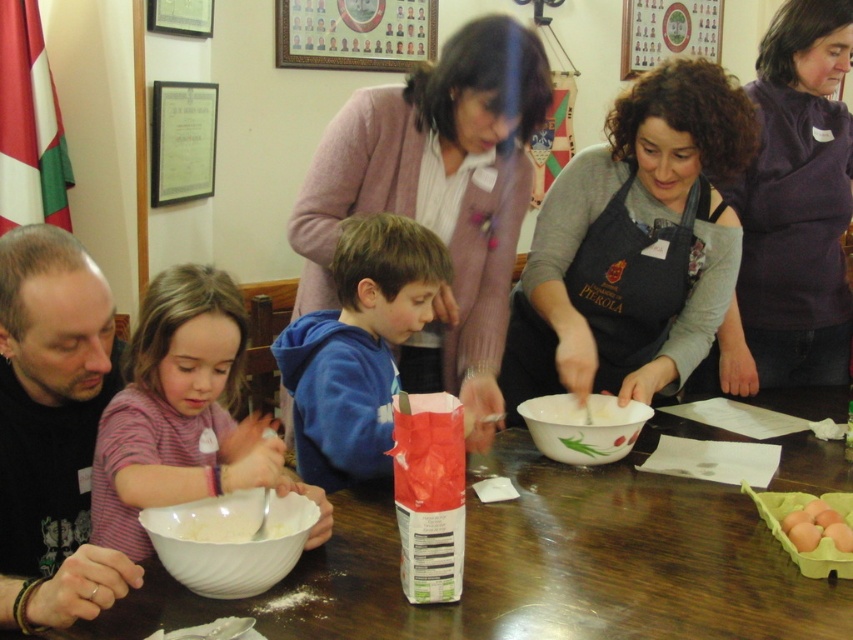
Question: Which point appears closest to the camera in this image?

Choices:
 (A) (97, 600)
 (B) (264, 516)
 (C) (590, 438)

Answer: (A)

Question: Is the position of wooden table at center more distant than that of white glossy bowl at center?

Choices:
 (A) no
 (B) yes

Answer: (A)

Question: Estimate the real-world distances between objects in this image. Which object is farther from the white glossy bowl at center?

Choices:
 (A) white glossy bowl at lower left
 (B) wooden table at center
 (C) blue fleece hoodie at center

Answer: (A)

Question: Does wooden table at center have a larger size compared to white glossy bowl at center?

Choices:
 (A) yes
 (B) no

Answer: (A)

Question: Can you confirm if wooden table at center is positioned to the left of pink striped shirt at left?

Choices:
 (A) yes
 (B) no

Answer: (B)

Question: Which point is closer to the camera?

Choices:
 (A) (94, 312)
 (B) (801, 538)
 (C) (196, 566)
 (D) (172, 474)

Answer: (C)